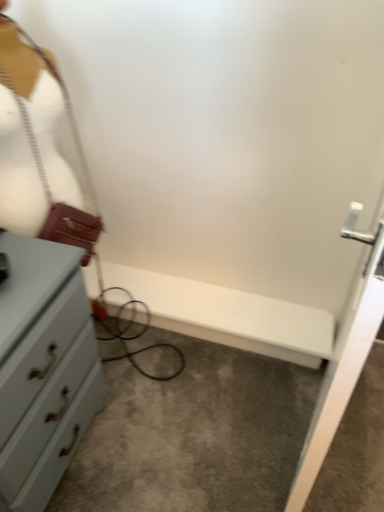
Question: Is black cable at left far away from leather-like white mannequin at left?

Choices:
 (A) yes
 (B) no

Answer: (B)

Question: From the image's perspective, would you say black cable at left is positioned over leather-like white mannequin at left?

Choices:
 (A) no
 (B) yes

Answer: (A)

Question: Is leather-like white mannequin at left located within black cable at left?

Choices:
 (A) yes
 (B) no

Answer: (A)

Question: Considering the relative sizes of black cable at left and leather-like white mannequin at left in the image provided, is black cable at left wider than leather-like white mannequin at left?

Choices:
 (A) yes
 (B) no

Answer: (A)

Question: From a real-world perspective, is black cable at left positioned under leather-like white mannequin at left based on gravity?

Choices:
 (A) yes
 (B) no

Answer: (A)

Question: From the image's perspective, would you say black cable at left is shown under leather-like white mannequin at left?

Choices:
 (A) no
 (B) yes

Answer: (B)

Question: Does leather-like white mannequin at left appear on the right side of black cable at left?

Choices:
 (A) no
 (B) yes

Answer: (B)

Question: Does leather-like white mannequin at left lie in front of black cable at left?

Choices:
 (A) no
 (B) yes

Answer: (A)

Question: Is leather-like white mannequin at left wider than black cable at left?

Choices:
 (A) no
 (B) yes

Answer: (A)

Question: From the image's perspective, is leather-like white mannequin at left beneath black cable at left?

Choices:
 (A) yes
 (B) no

Answer: (B)

Question: Is leather-like white mannequin at left outside of black cable at left?

Choices:
 (A) yes
 (B) no

Answer: (B)

Question: Is black cable at left at the back of leather-like white mannequin at left?

Choices:
 (A) yes
 (B) no

Answer: (A)

Question: From the image's perspective, is leather-like white mannequin at left located above or below black cable at left?

Choices:
 (A) below
 (B) above

Answer: (B)